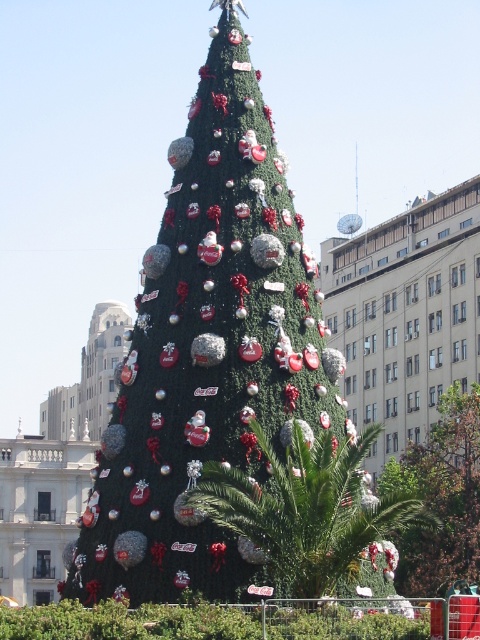
Is green textured christmas tree at center closer to camera compared to green leafy palm tree at center?

No, it is behind green leafy palm tree at center.

Is green textured christmas tree at center to the left of green leafy palm tree at center from the viewer's perspective?

Indeed, green textured christmas tree at center is positioned on the left side of green leafy palm tree at center.

Which is behind, point (219, 371) or point (289, 500)?

The point (219, 371) is behind.

What are the coordinates of `green textured christmas tree at center` in the screenshot? It's located at (208, 352).

Who is positioned more to the right, green leafy palm tree at center or green matte christmas tree at center?

green matte christmas tree at center is more to the right.

I want to click on green leafy palm tree at center, so click(305, 508).

Locate an element on the screen. green leafy palm tree at center is located at coordinates (305, 508).

Does point (211, 579) come behind point (479, 531)?

No.

Between point (248, 145) and point (431, 547), which one is positioned in front?

Point (248, 145)

Where is `green textured christmas tree at center`? The width and height of the screenshot is (480, 640). green textured christmas tree at center is located at coordinates (208, 352).